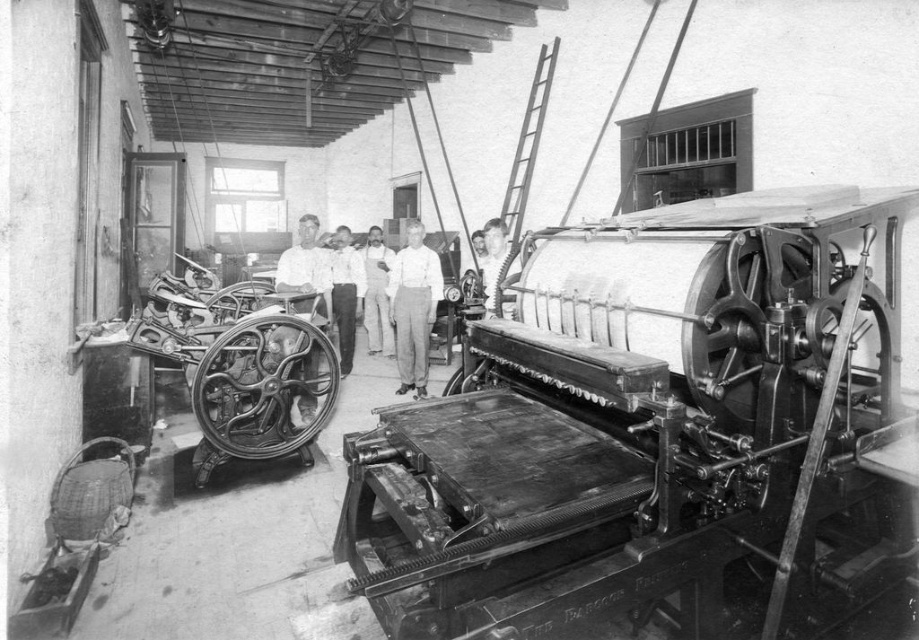
What do you see at coordinates (413, 307) in the screenshot?
I see `light gray cotton pants at center` at bounding box center [413, 307].

Where is `light gray cotton pants at center`? This screenshot has width=919, height=640. light gray cotton pants at center is located at coordinates (413, 307).

Does metallic/smooth printing press at center-right appear on the left side of light gray cotton pants at center?

No, metallic/smooth printing press at center-right is not to the left of light gray cotton pants at center.

Does point (352, 529) come behind point (414, 257)?

No.

Is point (588, 256) positioned in front of point (424, 374)?

Yes, point (588, 256) is in front of point (424, 374).

Locate an element on the screen. The height and width of the screenshot is (640, 919). metallic/smooth printing press at center-right is located at coordinates (647, 428).

Based on the photo, does white cotton overalls at center appear on the left side of smooth white shirt at center?

Yes, white cotton overalls at center is to the left of smooth white shirt at center.

Is white cotton overalls at center below smooth white shirt at center?

Correct, white cotton overalls at center is located below smooth white shirt at center.

Is point (380, 328) more distant than point (486, 259)?

That is True.

Locate an element on the screen. Image resolution: width=919 pixels, height=640 pixels. white cotton overalls at center is located at coordinates (376, 292).